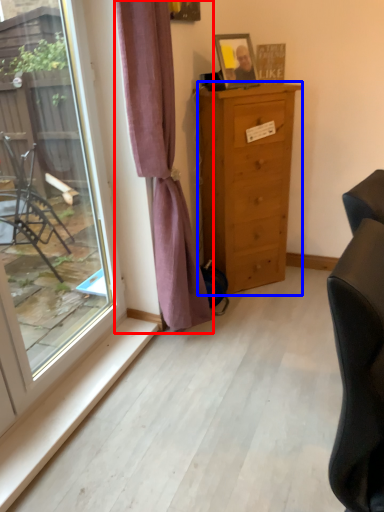
Question: Which object appears closest to the camera in this image, curtain (highlighted by a red box) or chest of drawers (highlighted by a blue box)?

Choices:
 (A) curtain
 (B) chest of drawers

Answer: (A)